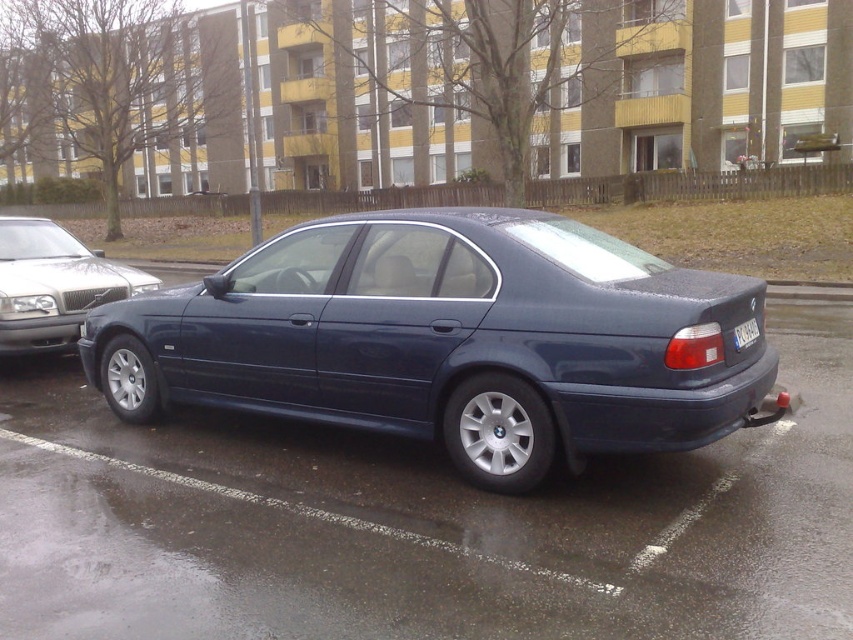
You are a parking attendant checking the alignment of vehicles in the parking lot. You see the satin dark blue sedan at left and the black plastic license plate at rear. Based on their positions, can you determine if the sedan is parked correctly within its parking space?

The satin dark blue sedan at left is above the black plastic license plate at rear, indicating that the sedan is properly aligned within its parking space as the license plate is positioned at the rear of the vehicle, which is typical for correct parking alignment.